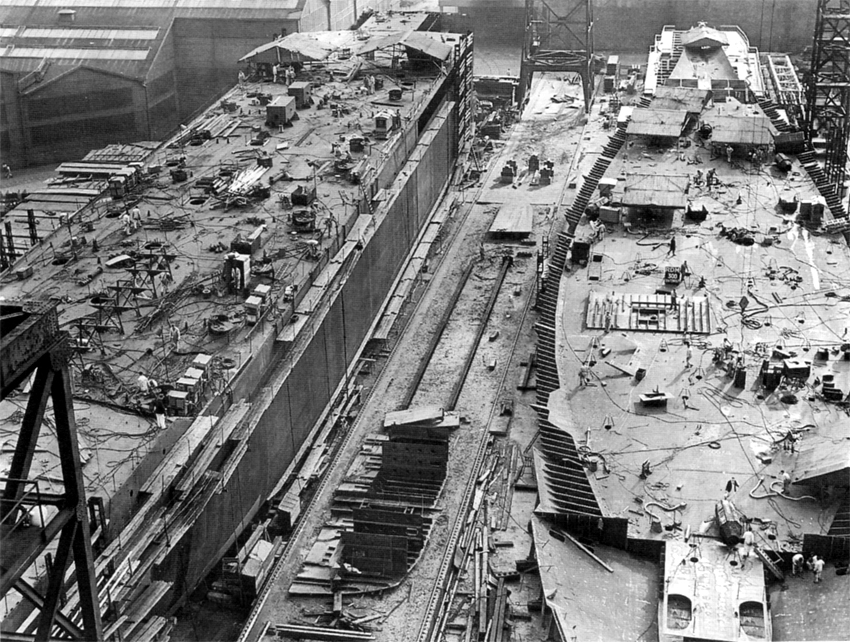
Where is `wall`? The height and width of the screenshot is (642, 850). wall is located at coordinates (289, 382).